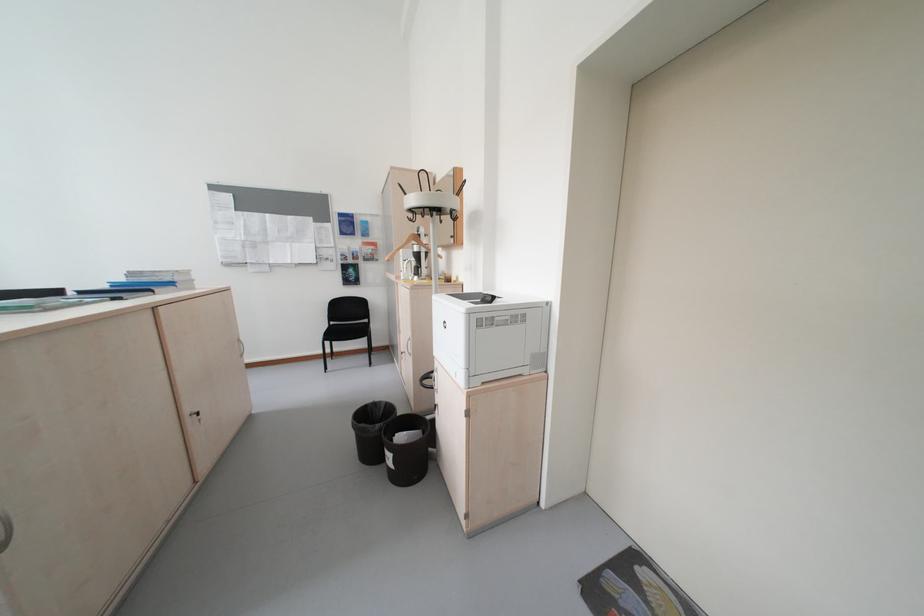
At what (x,y) coordinates should I click in order to perform the action: click on white coat rack hook. Please return your answer as a coordinate pair (x, y). Looking at the image, I should click on (431, 200).